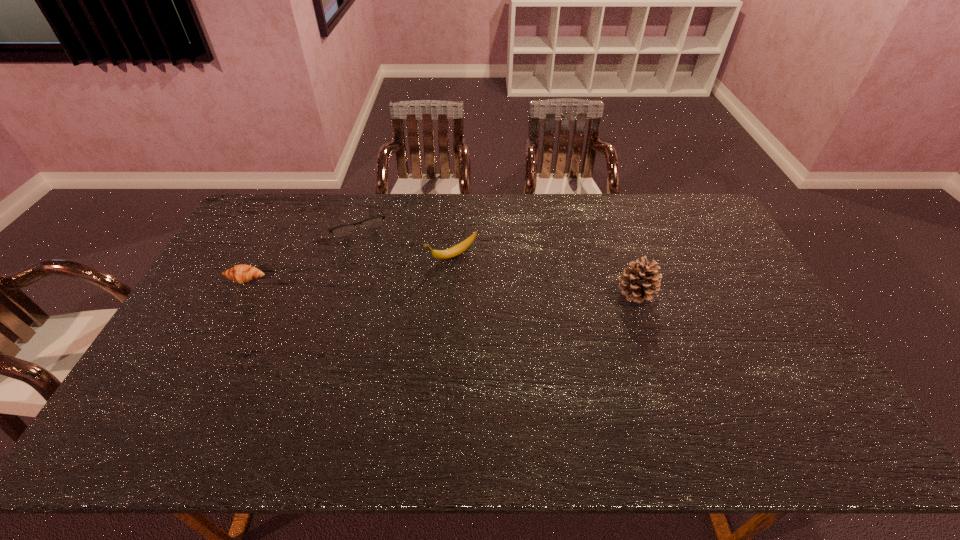
Image resolution: width=960 pixels, height=540 pixels. Identify the location of vacant spot on the desktop that is between the pastry and the rightmost object and is positioned on the front-facing side of the farthest object. click(x=381, y=284).

Where is `vacant spot on the desktop that is between the leftmost object and the pinecone and is positioned at the stem of the third shortest object`? Image resolution: width=960 pixels, height=540 pixels. vacant spot on the desktop that is between the leftmost object and the pinecone and is positioned at the stem of the third shortest object is located at coordinates (390, 284).